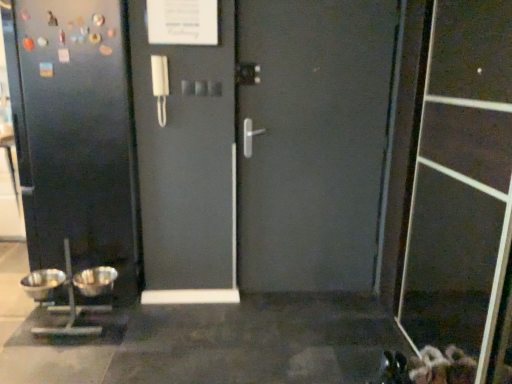
Question: Considering the relative sizes of silver metallic bowls at lower left and silver metallic mixing bowl at lower left, marked as the 1th mixing bowl in a right-to-left arrangement, in the image provided, is silver metallic bowls at lower left wider than silver metallic mixing bowl at lower left, marked as the 1th mixing bowl in a right-to-left arrangement,?

Choices:
 (A) no
 (B) yes

Answer: (B)

Question: Does silver metallic bowls at lower left appear on the right side of silver metallic mixing bowl at lower left, marked as the 1th mixing bowl in a right-to-left arrangement?

Choices:
 (A) yes
 (B) no

Answer: (B)

Question: Does silver metallic bowls at lower left appear on the left side of silver metallic mixing bowl at lower left, marked as the 1th mixing bowl in a right-to-left arrangement?

Choices:
 (A) no
 (B) yes

Answer: (B)

Question: Can silver metallic mixing bowl at lower left, marked as the second mixing bowl in a left-to-right arrangement, be found inside silver metallic bowls at lower left?

Choices:
 (A) yes
 (B) no

Answer: (A)

Question: From a real-world perspective, is silver metallic bowls at lower left on silver metallic mixing bowl at lower left, marked as the second mixing bowl in a left-to-right arrangement?

Choices:
 (A) yes
 (B) no

Answer: (A)

Question: Does silver metallic bowls at lower left have a lesser height compared to silver metallic mixing bowl at lower left, marked as the 1th mixing bowl in a right-to-left arrangement?

Choices:
 (A) yes
 (B) no

Answer: (B)

Question: Does silver metallic mixing bowl at lower left, which appears as the 1th mixing bowl when viewed from the left, come behind silver metallic mixing bowl at lower left, marked as the second mixing bowl in a left-to-right arrangement?

Choices:
 (A) no
 (B) yes

Answer: (A)

Question: Are silver metallic mixing bowl at lower left, which appears as the 1th mixing bowl when viewed from the left, and silver metallic mixing bowl at lower left, marked as the 1th mixing bowl in a right-to-left arrangement, far apart?

Choices:
 (A) no
 (B) yes

Answer: (A)

Question: Would you say silver metallic mixing bowl at lower left, marked as the second mixing bowl in a left-to-right arrangement, is part of silver metallic mixing bowl at lower left, the 2th mixing bowl when ordered from right to left,'s contents?

Choices:
 (A) no
 (B) yes

Answer: (A)

Question: From a real-world perspective, does silver metallic mixing bowl at lower left, which appears as the 1th mixing bowl when viewed from the left, stand above silver metallic mixing bowl at lower left, marked as the second mixing bowl in a left-to-right arrangement?

Choices:
 (A) yes
 (B) no

Answer: (A)

Question: Considering the relative sizes of silver metallic mixing bowl at lower left, the 2th mixing bowl when ordered from right to left, and silver metallic mixing bowl at lower left, marked as the 1th mixing bowl in a right-to-left arrangement, in the image provided, is silver metallic mixing bowl at lower left, the 2th mixing bowl when ordered from right to left, bigger than silver metallic mixing bowl at lower left, marked as the 1th mixing bowl in a right-to-left arrangement,?

Choices:
 (A) yes
 (B) no

Answer: (A)

Question: Is silver metallic mixing bowl at lower left, the 2th mixing bowl when ordered from right to left, oriented towards silver metallic mixing bowl at lower left, marked as the 1th mixing bowl in a right-to-left arrangement?

Choices:
 (A) yes
 (B) no

Answer: (B)

Question: From the image's perspective, would you say silver metallic bowls at lower left is positioned over transparent plastic screen door at lower right?

Choices:
 (A) yes
 (B) no

Answer: (B)